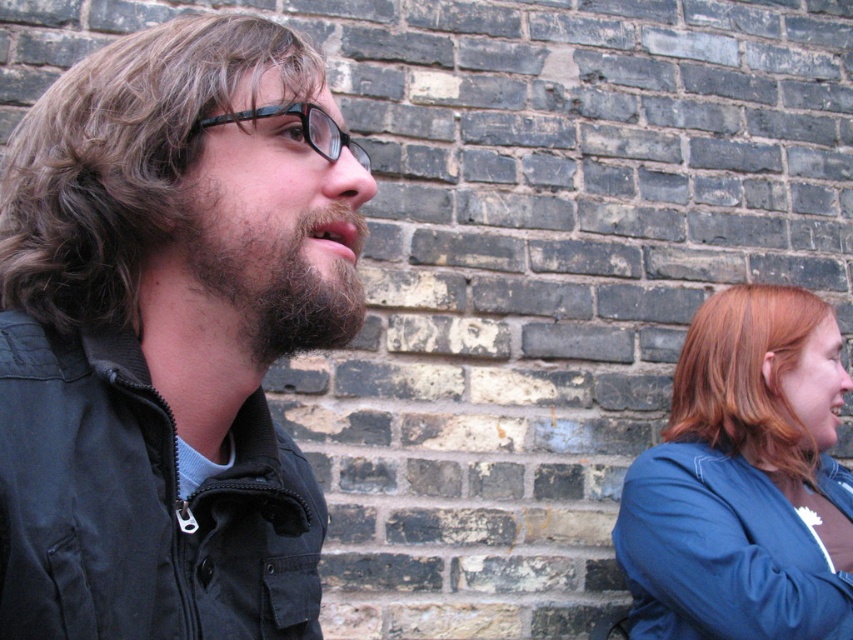
You are a photographer holding a camera. You want to take a photo of the black cotton jacket at left without moving the camera. Is the jacket within the camera lens range if the camera can focus on objects up to 5 feet away?

The black cotton jacket at left and camera are 5.52 feet apart from each other. Since the distance is more than 5 feet, the jacket is out of the camera lens range and cannot be focused properly.

You are an artist sketching the scene and need to ensure proportions are accurate. Which object, the black cotton jacket at left or the blonde hair at right, appears narrower in the image?

The black cotton jacket at left appears narrower than the blonde hair at right in the image.

You are a photographer adjusting the lighting in the scene. You need to ensure that both the blue fabric shirt at right and the dark brown fuzzy beard at left are evenly lit. Which object should you focus on adjusting the light towards first?

The blue fabric shirt at right is located below the dark brown fuzzy beard at left, so you should focus the light adjustment towards the dark brown fuzzy beard at left first to ensure both receive adequate illumination.